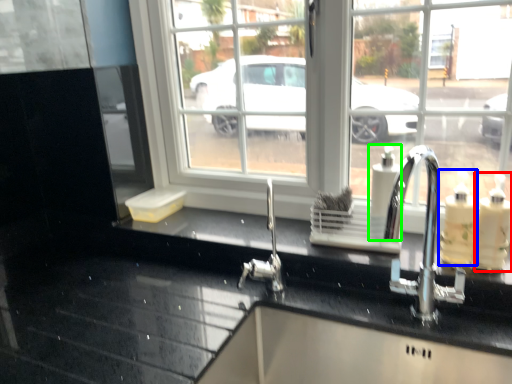
Question: Estimate the real-world distances between objects in this image. Which object is farther from soap dispenser (highlighted by a red box), soap dispenser (highlighted by a blue box) or soap dispenser (highlighted by a green box)?

Choices:
 (A) soap dispenser
 (B) soap dispenser

Answer: (B)